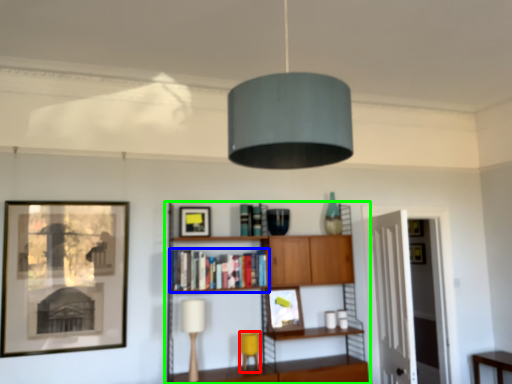
Question: Which is farther away from table lamp (highlighted by a red box)? book (highlighted by a blue box) or shelf (highlighted by a green box)?

Choices:
 (A) book
 (B) shelf

Answer: (A)